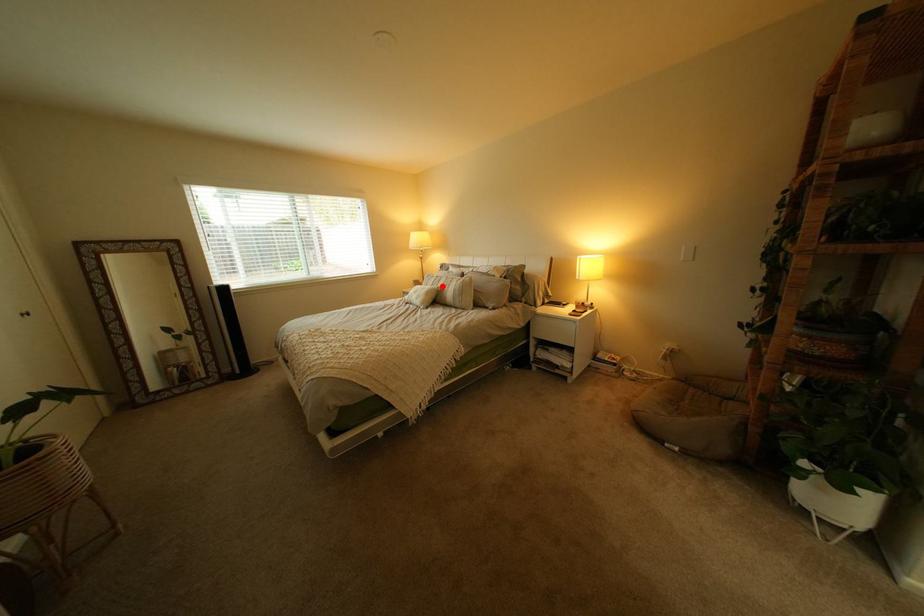
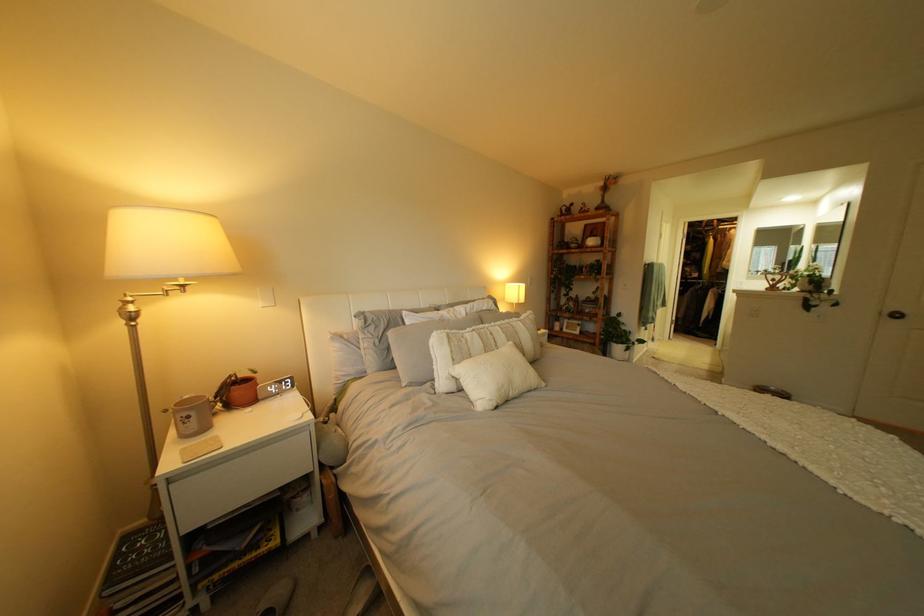
Locate, in the second image, the point that corresponds to the highlighted location in the first image.

(485, 355)